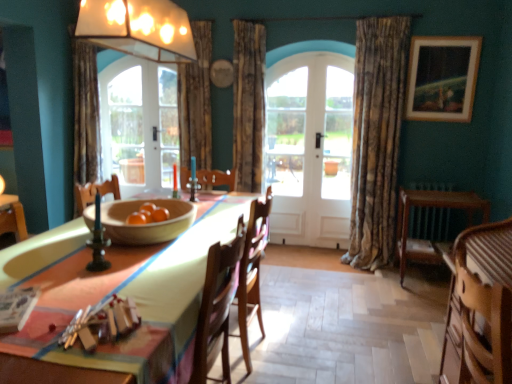
What do you see at coordinates (146, 224) in the screenshot? I see `wooden bowl at center` at bounding box center [146, 224].

What is the approximate width of textured brown curtain at center, which is counted as the 2th curtain, starting from the left?

15.32 inches.

At what (x,y) coordinates should I click in order to perform the action: click on clear glass door at center. Please return your answer as a coordinate pair (x, y). The height and width of the screenshot is (384, 512). Looking at the image, I should click on (286, 132).

Find the location of `wooden striped armchair at lower right`. wooden striped armchair at lower right is located at coordinates (487, 328).

Does wooden chair at center appear on the left side of wooden bowl at center?

In fact, wooden chair at center is to the right of wooden bowl at center.

Is wooden chair at center taller or shorter than wooden bowl at center?

In the image, wooden chair at center appears to be taller than wooden bowl at center.

From the image's perspective, is wooden chair at center below wooden bowl at center?

Correct, wooden chair at center appears lower than wooden bowl at center in the image.

Is wooden round table at right positioned with its back to wooden striped armchair at lower right?

No, wooden round table at right is not facing away from wooden striped armchair at lower right.

Considering the points (444, 217) and (461, 352), which point is behind, point (444, 217) or point (461, 352)?

Positioned behind is point (444, 217).

Measure the distance from wooden round table at right to wooden striped armchair at lower right.

The distance of wooden round table at right from wooden striped armchair at lower right is 2.21 meters.

From the image's perspective, which object appears higher, wooden round table at right or wooden striped armchair at lower right?

wooden round table at right is shown above in the image.

The height and width of the screenshot is (384, 512). What are the coordinates of `round table lying behind the wooden table at center` in the screenshot? It's located at (430, 223).

From a real-world perspective, is wooden table at center beneath wooden round table at right?

No, from a real-world perspective, wooden table at center is not under wooden round table at right.

From the picture: Which object is positioned more to the left, wooden table at center or wooden round table at right?

From the viewer's perspective, wooden table at center appears more on the left side.

Is wooden table at center shorter than wooden round table at right?

In fact, wooden table at center may be taller than wooden round table at right.

Between wooden round table at right and clear glass door at center, which one has less height?

Standing shorter between the two is wooden round table at right.

Could you tell me if wooden round table at right is facing clear glass door at center?

No, wooden round table at right is not oriented towards clear glass door at center.

From a real-world perspective, who is located higher, wooden round table at right or clear glass door at center?

From a 3D spatial view, clear glass door at center is above.

In terms of width, does wooden round table at right look wider or thinner when compared to clear glass door at center?

Considering their sizes, wooden round table at right looks broader than clear glass door at center.

Is wooden round table at right at the left side of white wooden door at center?

No.

Is wooden round table at right facing towards white wooden door at center?

No, wooden round table at right is not oriented towards white wooden door at center.

Considering the relative sizes of wooden round table at right and white wooden door at center in the image provided, is wooden round table at right bigger than white wooden door at center?

Yes, wooden round table at right is bigger than white wooden door at center.

Considering the relative positions of clear glass door at center and wooden table at center in the image provided, is clear glass door at center to the right of wooden table at center from the viewer's perspective?

Correct, you'll find clear glass door at center to the right of wooden table at center.

Find the location of a particular element. table that appears below the clear glass door at center (from the image's perspective) is located at coordinates (126, 296).

Is clear glass door at center not within wooden table at center?

Indeed, clear glass door at center is completely outside wooden table at center.

Can you confirm if clear glass door at center is thinner than wooden table at center?

Yes.

Based on the photo, which object is positioned more to the right, wooden bowl at center or white wooden door at center?

white wooden door at center.

Between point (176, 234) and point (342, 215), which one is positioned behind?

The point (342, 215) is behind.

Is wooden bowl at center located outside white wooden door at center?

wooden bowl at center lies outside white wooden door at center's area.

At what (x,y) coordinates should I click in order to perform the action: click on chair located behind the wooden bowl at center. Please return your answer as a coordinate pair (x, y). This screenshot has height=384, width=512. Looking at the image, I should click on [252, 272].

The image size is (512, 384). What are the coordinates of `round table on the right of wooden striped armchair at lower right` in the screenshot? It's located at (430, 223).

Estimate the real-world distances between objects in this image. Which object is closer to wooden framed painting at upper right, wooden table at center or white wooden door at center?

white wooden door at center is closer to wooden framed painting at upper right.

Estimate the real-world distances between objects in this image. Which object is further from textured brown curtain at center, marked as the second curtain in a right-to-left arrangement, white wooden door at center or wooden round table at right?

wooden round table at right.

Considering their positions, is wooden table at center positioned closer to textured beige curtain at right, positioned as the 3th curtain in left-to-right order, than wooden striped armchair at lower right?

wooden table at center.

From the image, which object appears to be nearer to wooden table at center, wooden striped armchair at lower right or wooden chair at center?

wooden chair at center is closer to wooden table at center.

From the image, which object appears to be farther from wooden bowl at center, wooden striped armchair at lower right or white glass screen door at center?

The object further to wooden bowl at center is white glass screen door at center.

Considering their positions, is wooden framed painting at upper right positioned closer to wooden round table at right than textured beige curtain at right, marked as the first curtain in a right-to-left arrangement?

Based on the image, textured beige curtain at right, marked as the first curtain in a right-to-left arrangement, appears to be nearer to wooden round table at right.

Considering their positions, is clear glass door at center positioned further to textured brown curtain at center, which is counted as the 2th curtain, starting from the left, than white wooden door at center?

white wooden door at center is positioned further to the anchor textured brown curtain at center, which is counted as the 2th curtain, starting from the left.

Considering their positions, is white wooden door at center positioned further to clear glass door at center than wooden striped armchair at lower right?

wooden striped armchair at lower right lies further to clear glass door at center than the other object.

At what (x,y) coordinates should I click in order to perform the action: click on chair between wooden striped armchair at lower right and white wooden door at center along the z-axis. Please return your answer as a coordinate pair (x, y). Looking at the image, I should click on (252, 272).

This screenshot has width=512, height=384. I want to click on bowl between wooden table at center and white glass screen door at center along the z-axis, so click(x=146, y=224).

What are the coordinates of `bowl between wooden striped armchair at lower right and textured beige curtain at right, marked as the first curtain in a right-to-left arrangement, along the z-axis` in the screenshot? It's located at (146, 224).

You are a GUI agent. You are given a task and a screenshot of the screen. Output one action in this format:
    pyautogui.click(x=<x>, y=<y>)
    Task: Click on the chair positioned between wooden bowl at center and textured brown curtain at center, which is counted as the 2th curtain, starting from the left, from near to far
    The height and width of the screenshot is (384, 512).
    Given the screenshot: What is the action you would take?
    pyautogui.click(x=252, y=272)